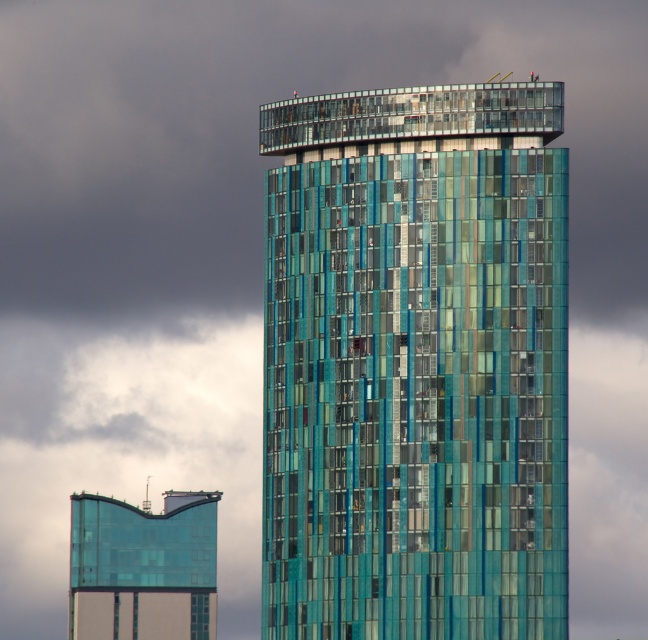
Question: Does teal glass tower at center have a lesser width compared to transparent glass tower at lower left?

Choices:
 (A) no
 (B) yes

Answer: (A)

Question: Can you confirm if teal glass tower at center is wider than transparent glass tower at lower left?

Choices:
 (A) no
 (B) yes

Answer: (B)

Question: Which point is farther from the camera taking this photo?

Choices:
 (A) (341, 563)
 (B) (119, 602)

Answer: (B)

Question: Among these points, which one is farthest from the camera?

Choices:
 (A) (531, 102)
 (B) (176, 561)

Answer: (B)

Question: Is teal glass tower at center smaller than transparent glass tower at lower left?

Choices:
 (A) no
 (B) yes

Answer: (A)